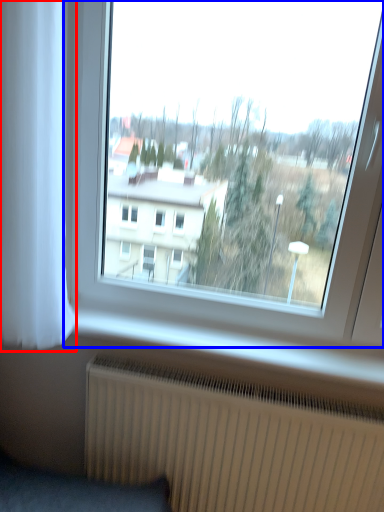
Question: Which point is closer to the camera, curtain (highlighted by a red box) or window (highlighted by a blue box)?

Choices:
 (A) curtain
 (B) window

Answer: (A)